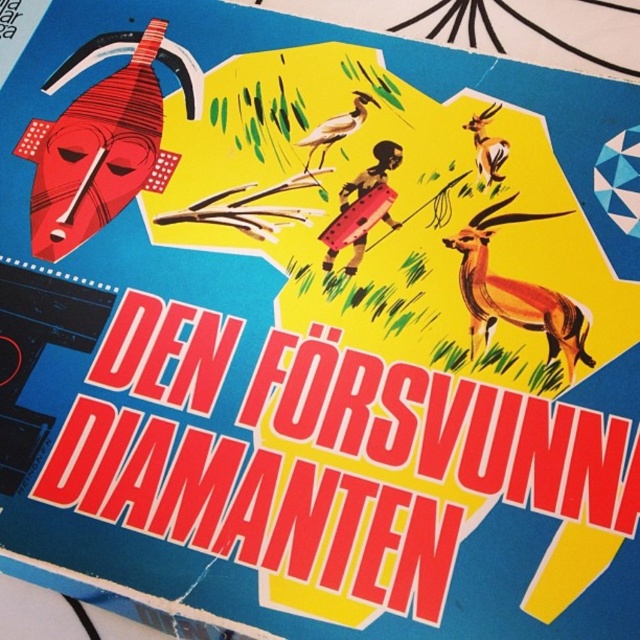
What is the spatial relationship between the brown matte bird at center and the orange glossy antelope at upper right in terms of width?

The brown matte bird at center is wider than the orange glossy antelope at upper right according to the description.

You are an artist trying to place a new element in the image. The brown matte bird at center is positioned at coordinates 0.200 on the horizontal axis and 0.527 on the vertical axis. If you want to place a new element exactly 0.1 units to the right of the bird, what would be the new horizontal coordinate?

The new horizontal coordinate would be 0.200 plus 0.1, which equals 0.300. So the new horizontal coordinate is 0.300.

In the vibrant illustration with a blue background, you see an orange glossy antelope at center and a brown matte bird at center. Which of these two animals appears bigger in the image?

The orange glossy antelope at center is larger in size than the brown matte bird at center.